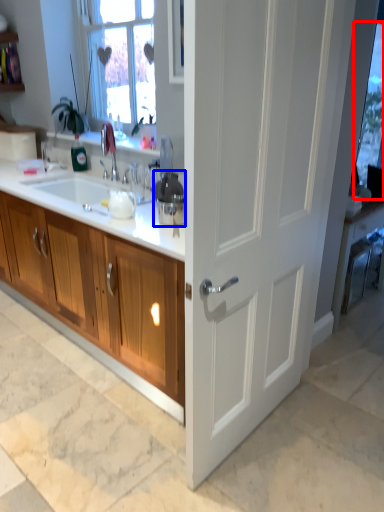
Question: Which of the following is the closest to the observer, window screen (highlighted by a red box) or appliance (highlighted by a blue box)?

Choices:
 (A) window screen
 (B) appliance

Answer: (B)